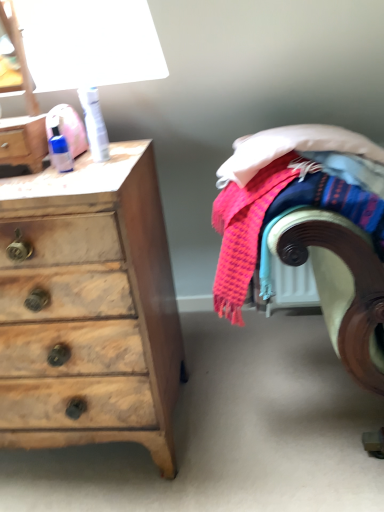
Question: From the image's perspective, is blue plastic bottle at upper left, marked as the 1th toiletry in a left-to-right arrangement, under white plastic can at upper left, arranged as the second toiletry when viewed from the left?

Choices:
 (A) no
 (B) yes

Answer: (B)

Question: Can white plastic can at upper left, arranged as the second toiletry when viewed from the left, be found inside blue plastic bottle at upper left, which is counted as the 2th toiletry, starting from the right?

Choices:
 (A) no
 (B) yes

Answer: (A)

Question: Does blue plastic bottle at upper left, which is counted as the 2th toiletry, starting from the right, have a greater width compared to white plastic can at upper left, placed as the first toiletry when sorted from right to left?

Choices:
 (A) yes
 (B) no

Answer: (B)

Question: Is blue plastic bottle at upper left, which is counted as the 2th toiletry, starting from the right, closer to camera compared to white plastic can at upper left, placed as the first toiletry when sorted from right to left?

Choices:
 (A) no
 (B) yes

Answer: (B)

Question: Is blue plastic bottle at upper left, which is counted as the 2th toiletry, starting from the right, beside white plastic can at upper left, placed as the first toiletry when sorted from right to left?

Choices:
 (A) yes
 (B) no

Answer: (B)

Question: Is point (284, 190) positioned closer to the camera than point (99, 135)?

Choices:
 (A) farther
 (B) closer

Answer: (B)

Question: Is textured woolen blanket at right taller or shorter than white plastic can at upper left, arranged as the second toiletry when viewed from the left?

Choices:
 (A) tall
 (B) short

Answer: (A)

Question: In the image, is textured woolen blanket at right on the left side or the right side of white plastic can at upper left, arranged as the second toiletry when viewed from the left?

Choices:
 (A) left
 (B) right

Answer: (B)

Question: Considering the positions of textured woolen blanket at right and white plastic can at upper left, arranged as the second toiletry when viewed from the left, in the image, is textured woolen blanket at right bigger or smaller than white plastic can at upper left, arranged as the second toiletry when viewed from the left,?

Choices:
 (A) small
 (B) big

Answer: (B)

Question: Considering the positions of white plastic can at upper left, placed as the first toiletry when sorted from right to left, and blue plastic bottle at upper left, which is counted as the 2th toiletry, starting from the right, in the image, is white plastic can at upper left, placed as the first toiletry when sorted from right to left, wider or thinner than blue plastic bottle at upper left, which is counted as the 2th toiletry, starting from the right,?

Choices:
 (A) wide
 (B) thin

Answer: (A)

Question: Is point (102, 119) positioned closer to the camera than point (61, 158)?

Choices:
 (A) farther
 (B) closer

Answer: (A)

Question: Looking at the image, does white plastic can at upper left, placed as the first toiletry when sorted from right to left, seem bigger or smaller compared to blue plastic bottle at upper left, which is counted as the 2th toiletry, starting from the right?

Choices:
 (A) big
 (B) small

Answer: (A)

Question: From the image's perspective, is white plastic can at upper left, arranged as the second toiletry when viewed from the left, positioned above or below blue plastic bottle at upper left, which is counted as the 2th toiletry, starting from the right?

Choices:
 (A) above
 (B) below

Answer: (A)

Question: Is matte plastic bottle at upper left in front of or behind wooden chest of drawers at left in the image?

Choices:
 (A) behind
 (B) front

Answer: (A)

Question: From the image's perspective, is matte plastic bottle at upper left located above or below wooden chest of drawers at left?

Choices:
 (A) above
 (B) below

Answer: (A)